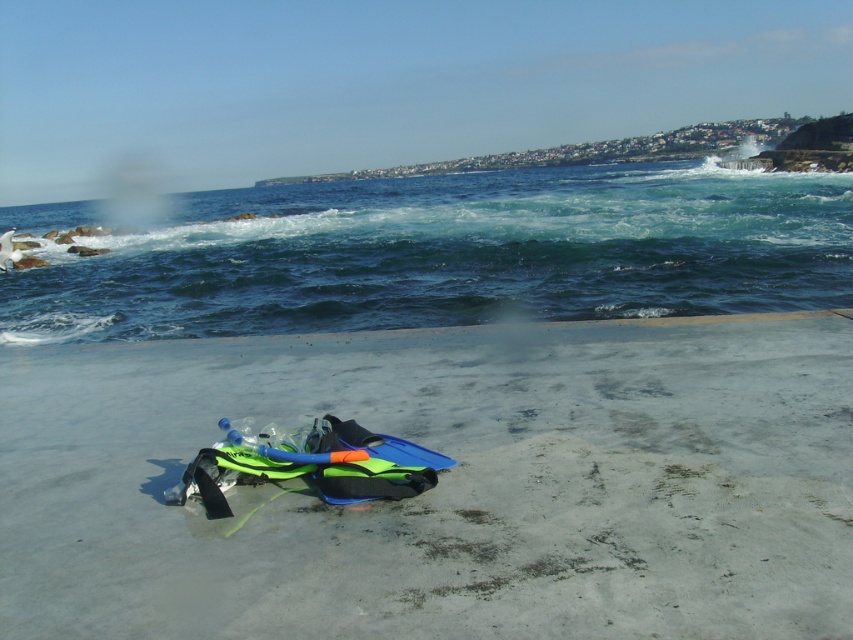
Question: Does gray concrete at center have a larger size compared to greenish-blue water at upper center?

Choices:
 (A) yes
 (B) no

Answer: (B)

Question: Among these objects, which one is farthest from the camera?

Choices:
 (A) gray concrete at center
 (B) greenish-blue water at upper center

Answer: (B)

Question: Is gray concrete at center to the left of greenish-blue water at upper center from the viewer's perspective?

Choices:
 (A) yes
 (B) no

Answer: (B)

Question: Which point appears closest to the camera in this image?

Choices:
 (A) (712, 282)
 (B) (78, 628)

Answer: (B)

Question: Is gray concrete at center in front of greenish-blue water at upper center?

Choices:
 (A) yes
 (B) no

Answer: (A)